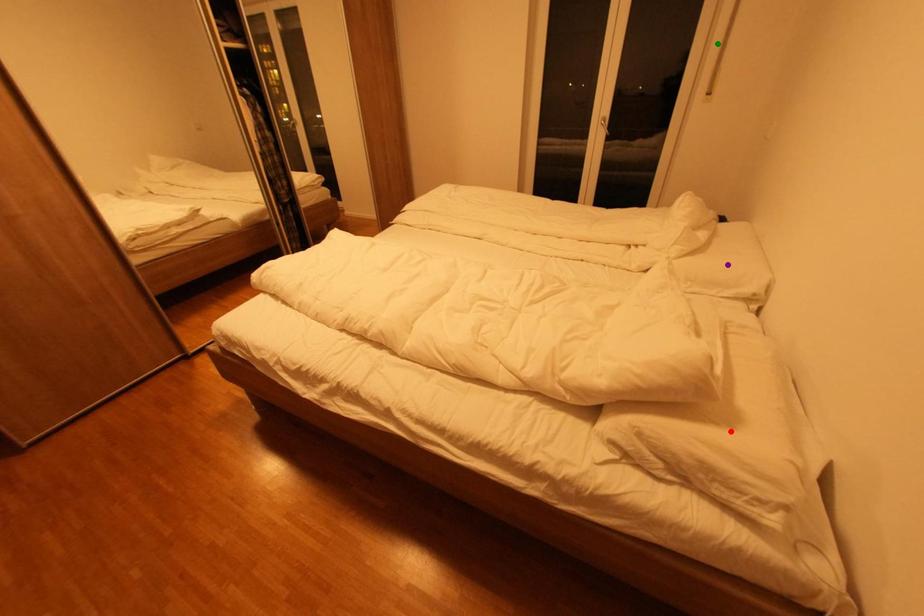
From the picture: Order these from nearest to farthest:
A) purple point
B) red point
C) green point

red point
purple point
green point